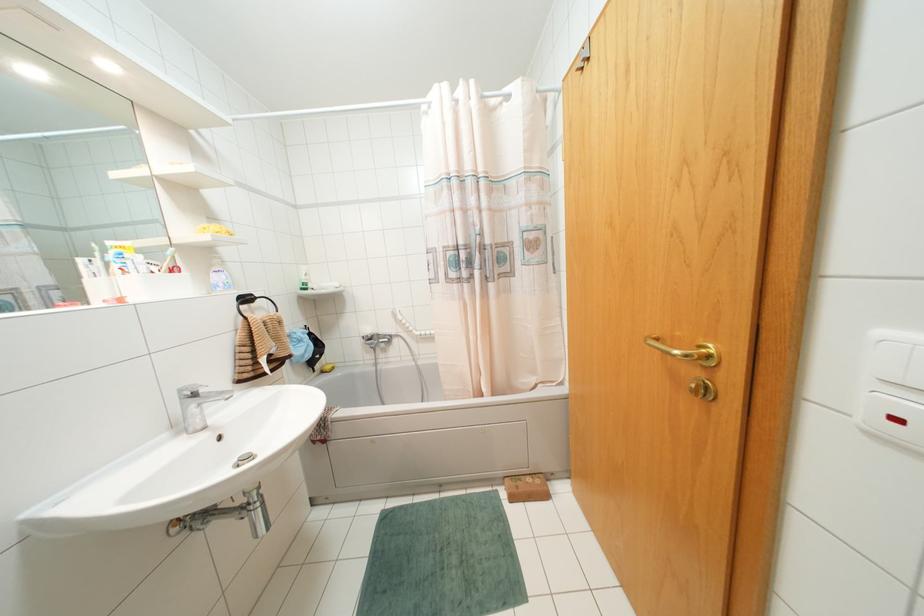
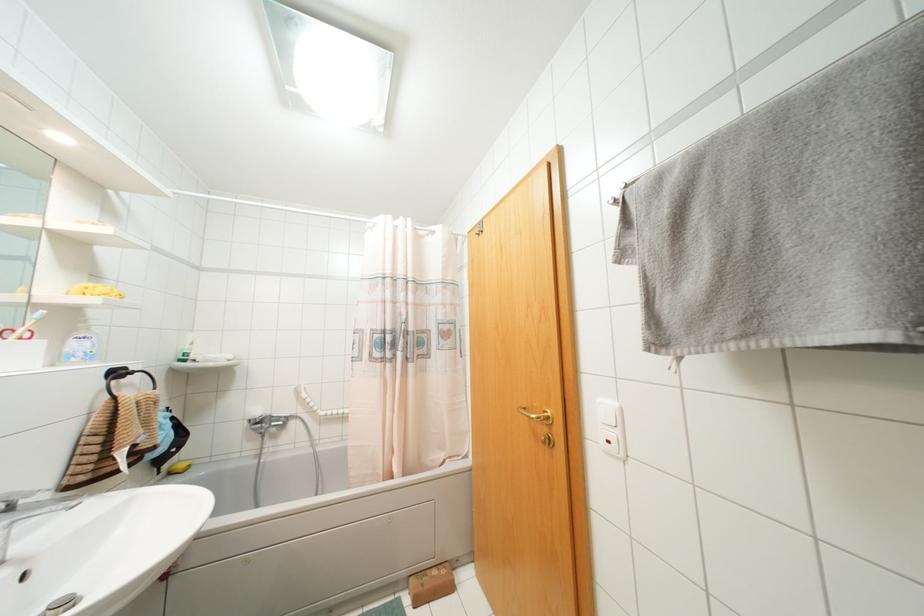
In the second image, find the point that corresponds to (219,249) in the first image.

(89, 310)